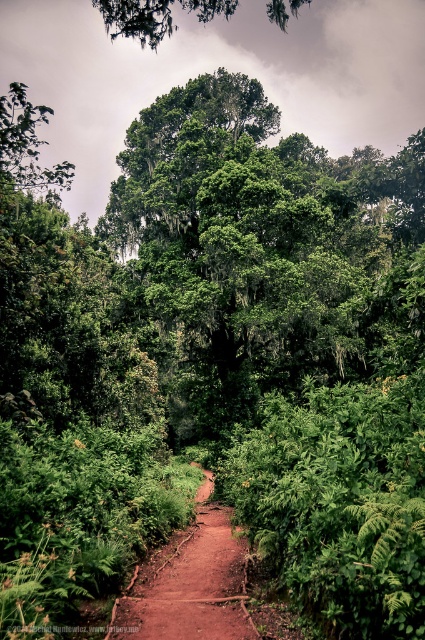
In the scene shown: You are a hiker trying to navigate through the forest. You see the brown dirt track at center and the green leafy tree at upper center. Which of these two has a wider width?

The green leafy tree at upper center has a wider width compared to the brown dirt track at center.

You are a hiker who wants to reach the green leafy tree at upper center from the brown dirt track at center. Can you estimate how far you need to walk to reach the tree from the track?

The brown dirt track at center and green leafy tree at upper center are 58.27 meters apart, so you need to walk approximately 58.27 meters to reach the tree from the track.

You are a hiker standing on the brown dirt track at center and want to reach the green leafy tree at upper center. Which direction should you walk to get closer to the tree?

You should walk forward along the brown dirt track at center because it is closer to you than the green leafy tree at upper center, so moving forward along the path will lead you toward the tree.